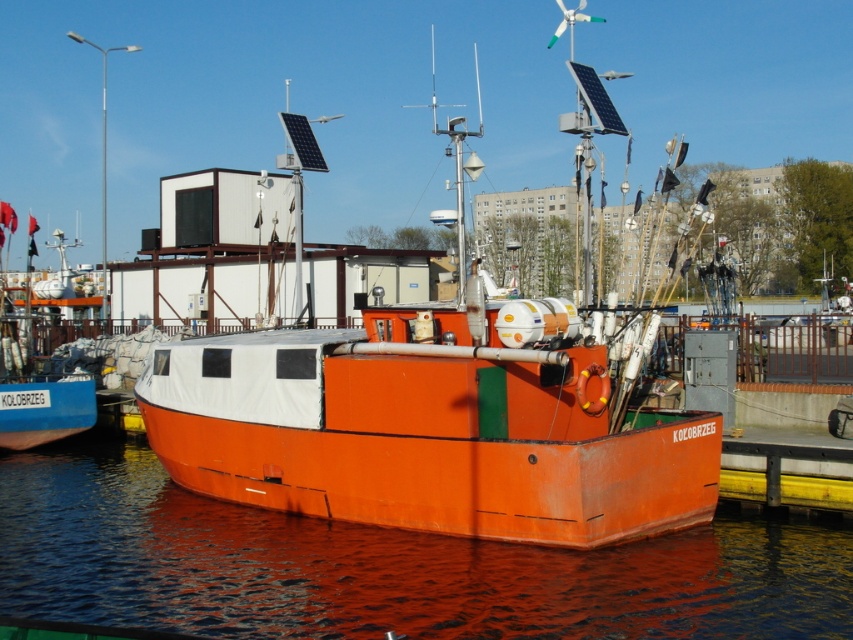
Describe the element at coordinates (433, 424) in the screenshot. I see `orange matte boat at center` at that location.

Looking at this image, can you confirm if orange matte boat at center is smaller than glossy orange water at lower center?

No, orange matte boat at center is not smaller than glossy orange water at lower center.

Between point (686, 520) and point (695, 632), which one is positioned behind?

Positioned behind is point (686, 520).

Where is `orange matte boat at center`? The height and width of the screenshot is (640, 853). orange matte boat at center is located at coordinates (433, 424).

Between point (469, 524) and point (12, 212), which one is positioned in front?

Point (469, 524) is in front.

Can you confirm if orange matte boat at center is positioned above orange matte boat at left?

Actually, orange matte boat at center is below orange matte boat at left.

Locate an element on the screen. This screenshot has width=853, height=640. orange matte boat at center is located at coordinates (433, 424).

Who is positioned more to the right, glossy orange water at lower center or orange matte boat at left?

Positioned to the right is glossy orange water at lower center.

Is glossy orange water at lower center wider than orange matte boat at left?

Yes.

Between point (567, 620) and point (38, 428), which one is positioned in front?

Point (567, 620) is more forward.

Identify the location of glossy orange water at lower center. The image size is (853, 640). (384, 566).